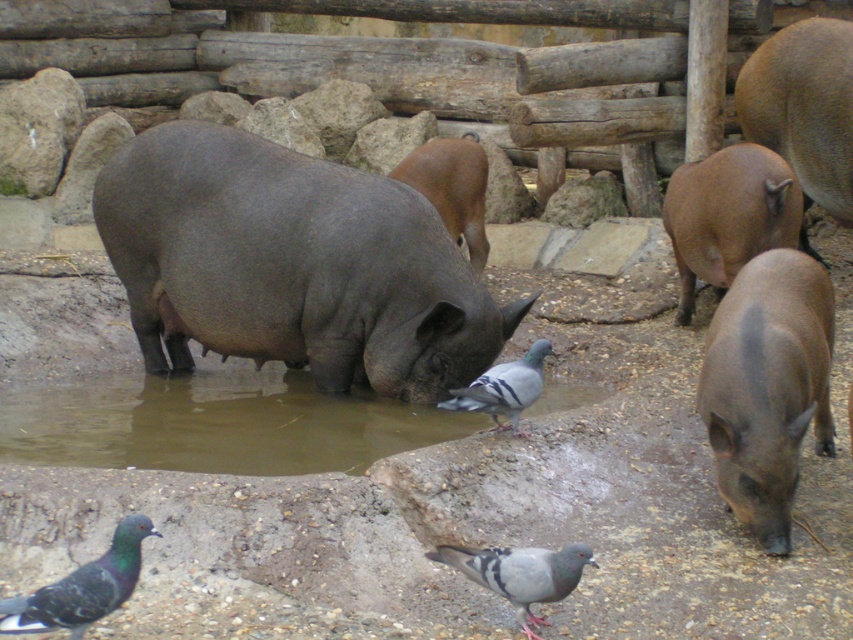
Question: Among these points, which one is nearest to the camera?

Choices:
 (A) (434, 189)
 (B) (74, 570)

Answer: (B)

Question: Can you confirm if brown matte pig at center-right is thinner than brown matte pig at center?

Choices:
 (A) no
 (B) yes

Answer: (B)

Question: Which object appears closest to the camera in this image?

Choices:
 (A) gray matte pigeon at lower center
 (B) brown matte pig at center-right
 (C) gray matte hippo at center
 (D) dark brown matte pig at lower right

Answer: (A)

Question: Can you confirm if gray matte hippo at center is positioned above gray speckled pigeon at lower left?

Choices:
 (A) no
 (B) yes

Answer: (B)

Question: Is dark brown matte pig at lower right above gray speckled pigeon at center?

Choices:
 (A) no
 (B) yes

Answer: (A)

Question: Which object appears farthest from the camera in this image?

Choices:
 (A) brown muddy puddle at lower center
 (B) dark brown matte pig at lower right

Answer: (A)